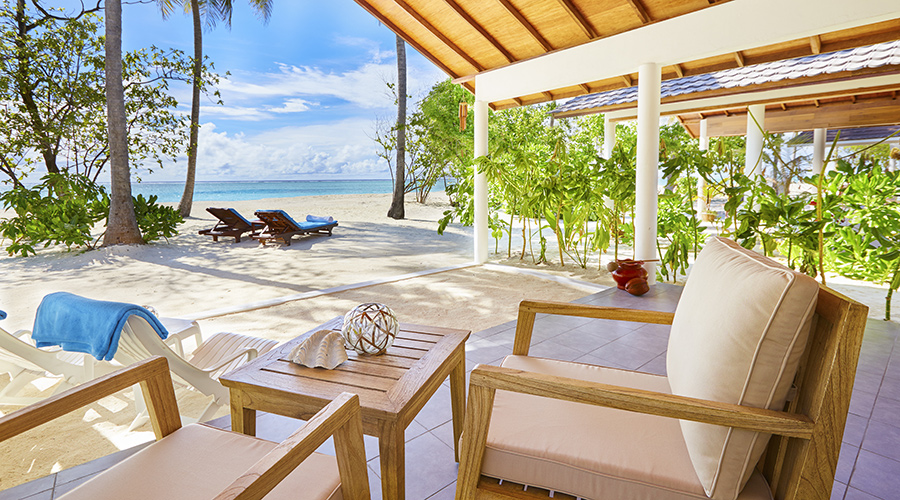
Where is `chairs`? The image size is (900, 500). chairs is located at coordinates (145, 481), (572, 435), (235, 224), (298, 225), (223, 348), (176, 332).